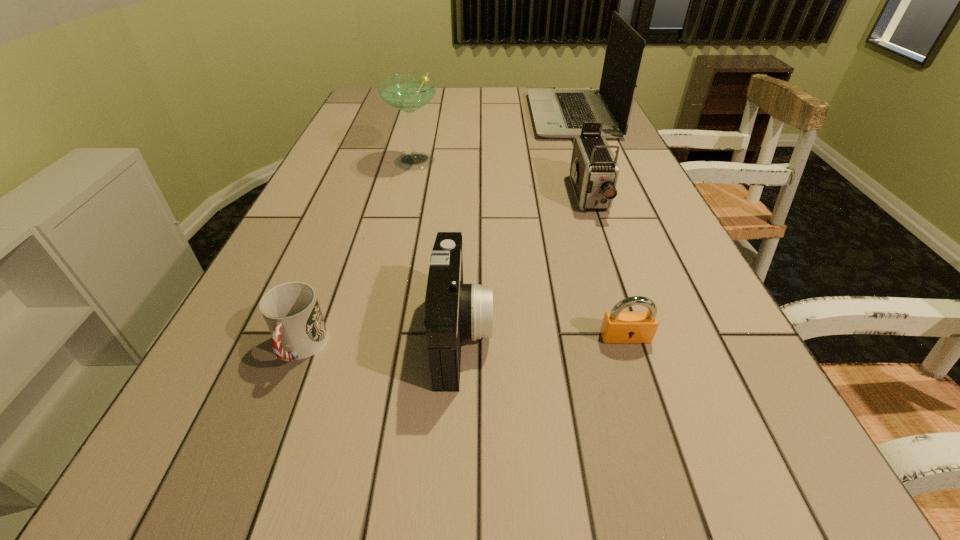
The image size is (960, 540). What are the coordinates of `camcorder present at the right edge` in the screenshot? It's located at (594, 171).

Locate an element on the screen. The image size is (960, 540). padlock present at the right edge is located at coordinates (617, 327).

The image size is (960, 540). Find the location of `object positioned at the far right corner`. object positioned at the far right corner is located at coordinates (558, 113).

Identify the location of vacant space at the far edge of the desktop. (520, 94).

Locate an element on the screen. The height and width of the screenshot is (540, 960). vacant space at the left edge is located at coordinates (271, 416).

Locate an element on the screen. The image size is (960, 540). vacant area at the right edge is located at coordinates (711, 298).

Locate an element on the screen. The image size is (960, 540). free space between the nearer camcorder and the padlock is located at coordinates (543, 336).

The width and height of the screenshot is (960, 540). I want to click on free spot between the third object from left to right and the right camcorder, so click(525, 265).

Find the location of a particular element. This screenshot has height=540, width=960. vacant space that's between the padlock and the cup is located at coordinates (463, 343).

Locate an element on the screen. Image resolution: width=960 pixels, height=540 pixels. empty space between the padlock and the laptop computer is located at coordinates click(598, 227).